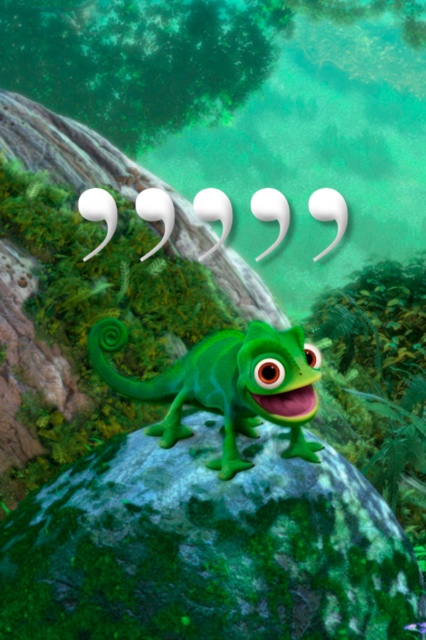
Who is higher up, green mossy rock at center or green rubber lizard at center?

Positioned higher is green rubber lizard at center.

Can you confirm if green mossy rock at center is smaller than green rubber lizard at center?

Incorrect, green mossy rock at center is not smaller in size than green rubber lizard at center.

Who is more distant from viewer, (x=212, y=556) or (x=252, y=323)?

Point (x=252, y=323)

Find the location of a particular element. The height and width of the screenshot is (640, 426). green mossy rock at center is located at coordinates (206, 548).